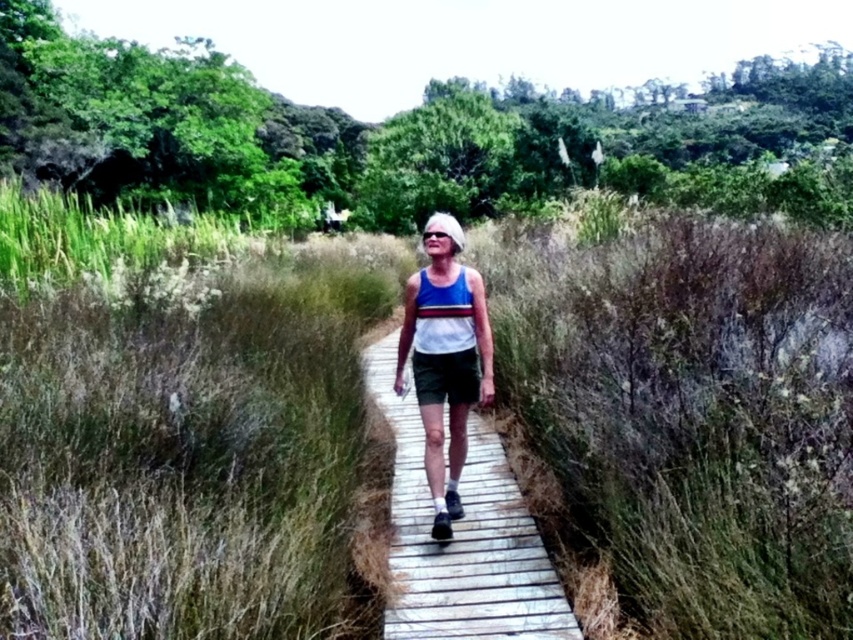
Question: Which point appears farthest from the camera in this image?

Choices:
 (A) (442, 490)
 (B) (67, 218)
 (C) (12, 288)
 (D) (477, 481)

Answer: (B)

Question: Can you confirm if green grass at center is smaller than white fabric tank top at center?

Choices:
 (A) yes
 (B) no

Answer: (A)

Question: Among these points, which one is nearest to the camera?

Choices:
 (A) (445, 616)
 (B) (469, 509)
 (C) (64, 220)
 (D) (457, 440)

Answer: (A)

Question: Considering the relative positions of green grass at center and wooden boardwalk at center in the image provided, where is green grass at center located with respect to wooden boardwalk at center?

Choices:
 (A) left
 (B) right

Answer: (A)

Question: Does green grass at center appear on the left side of white fabric tank top at center?

Choices:
 (A) yes
 (B) no

Answer: (A)

Question: Which object appears closest to the camera in this image?

Choices:
 (A) green grass at center
 (B) green grass at upper left
 (C) wooden boardwalk at center

Answer: (C)